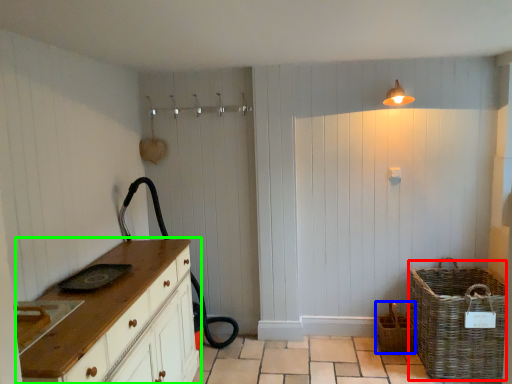
Question: Considering the real-world distances, which object is closest to basket (highlighted by a red box)? basket (highlighted by a blue box) or chest of drawers (highlighted by a green box).

Choices:
 (A) basket
 (B) chest of drawers

Answer: (A)